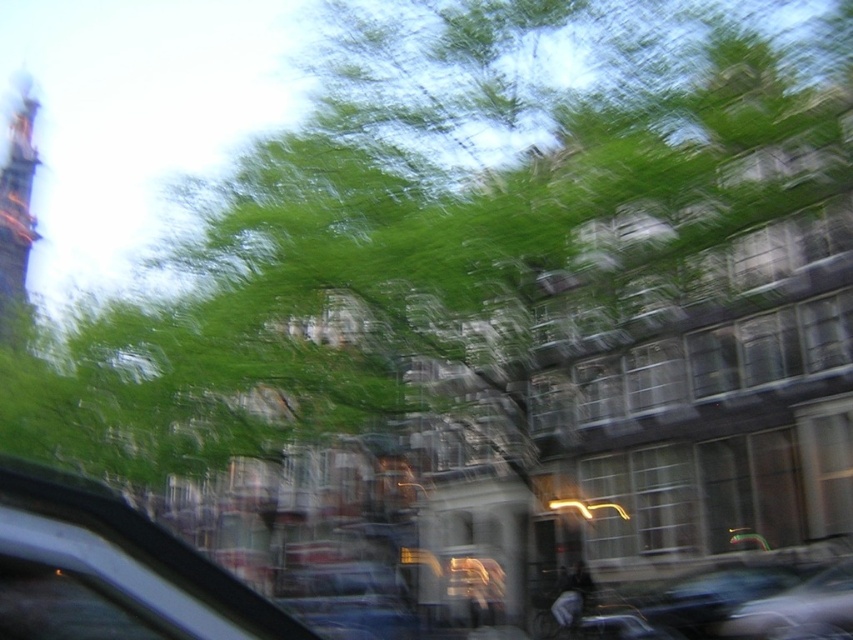
Is point (190, 595) closer to camera compared to point (839, 588)?

Yes, point (190, 595) is in front of point (839, 588).

Who is positioned more to the right, transparent glass car window at lower left or metallic silver car at lower right?

Positioned to the right is metallic silver car at lower right.

Between point (223, 636) and point (824, 566), which one is positioned in front?

Point (223, 636) is in front.

Identify the location of transparent glass car window at lower left. [111, 572].

Who is positioned more to the left, metallic silver car at lower right or dark brown wooden tower at upper left?

dark brown wooden tower at upper left is more to the left.

Does metallic silver car at lower right have a larger size compared to dark brown wooden tower at upper left?

No.

Where is `metallic silver car at lower right`? metallic silver car at lower right is located at coordinates (798, 609).

Does transparent glass car window at lower left have a larger size compared to dark brown wooden tower at upper left?

No, transparent glass car window at lower left is not bigger than dark brown wooden tower at upper left.

Is transparent glass car window at lower left wider than dark brown wooden tower at upper left?

In fact, transparent glass car window at lower left might be narrower than dark brown wooden tower at upper left.

What do you see at coordinates (111, 572) in the screenshot? Image resolution: width=853 pixels, height=640 pixels. I see `transparent glass car window at lower left` at bounding box center [111, 572].

Locate an element on the screen. The width and height of the screenshot is (853, 640). transparent glass car window at lower left is located at coordinates (111, 572).